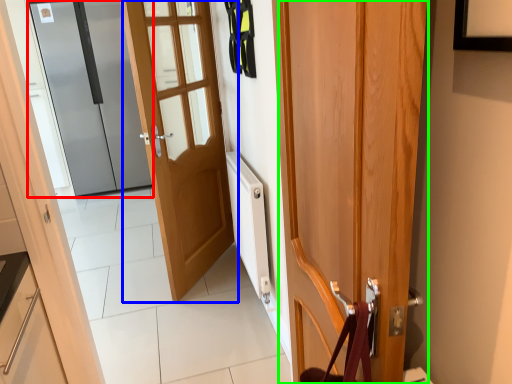
Question: Which is farther away from door (highlighted by a red box)? door (highlighted by a blue box) or door (highlighted by a green box)?

Choices:
 (A) door
 (B) door

Answer: (B)